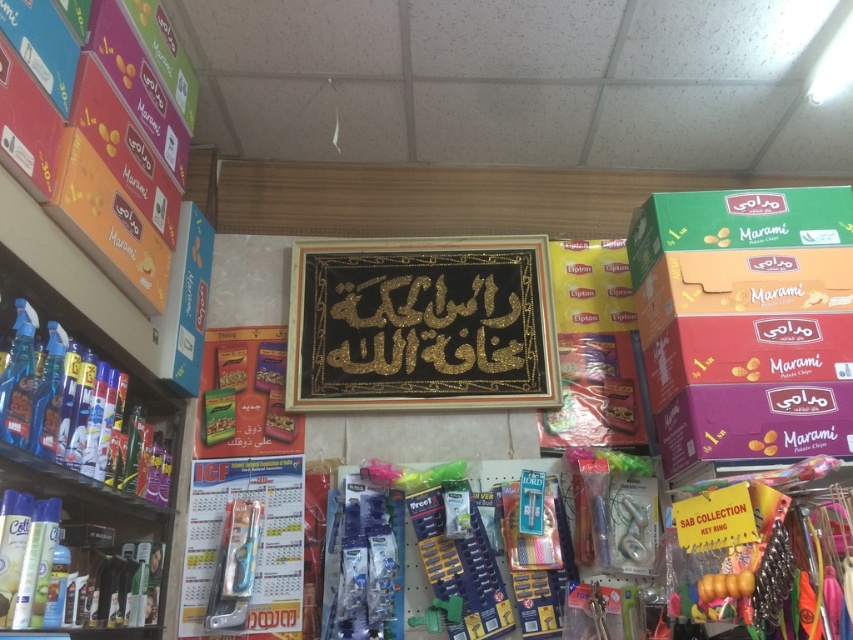
Question: Considering the real-world distances, which object is closest to the shiny plastic bottles at left?

Choices:
 (A) orange matte box at upper left
 (B) green matte box at right

Answer: (A)

Question: Is green matte box at right below shiny plastic bottles at left?

Choices:
 (A) no
 (B) yes

Answer: (A)

Question: From the image, what is the correct spatial relationship of gold glitter calligraphy at center in relation to orange matte box at upper left?

Choices:
 (A) left
 (B) right

Answer: (B)

Question: Which is farther from the orange matte box at upper left?

Choices:
 (A) shiny plastic bottles at left
 (B) gold glitter calligraphy at center

Answer: (B)

Question: From the image, what is the correct spatial relationship of green matte box at right in relation to orange matte box at upper left?

Choices:
 (A) below
 (B) above

Answer: (A)

Question: Which is nearer to the gold glitter calligraphy at center?

Choices:
 (A) orange matte box at upper left
 (B) green matte box at right

Answer: (B)